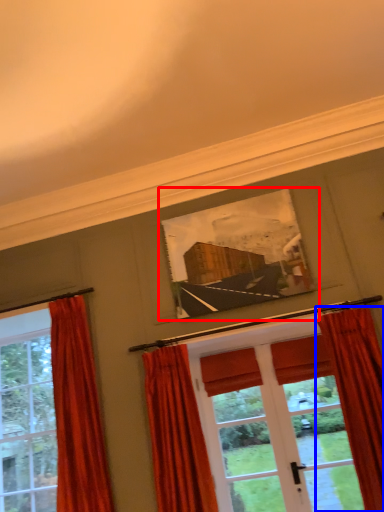
Question: Among these objects, which one is farthest to the camera, picture frame (highlighted by a red box) or curtain (highlighted by a blue box)?

Choices:
 (A) picture frame
 (B) curtain

Answer: (A)